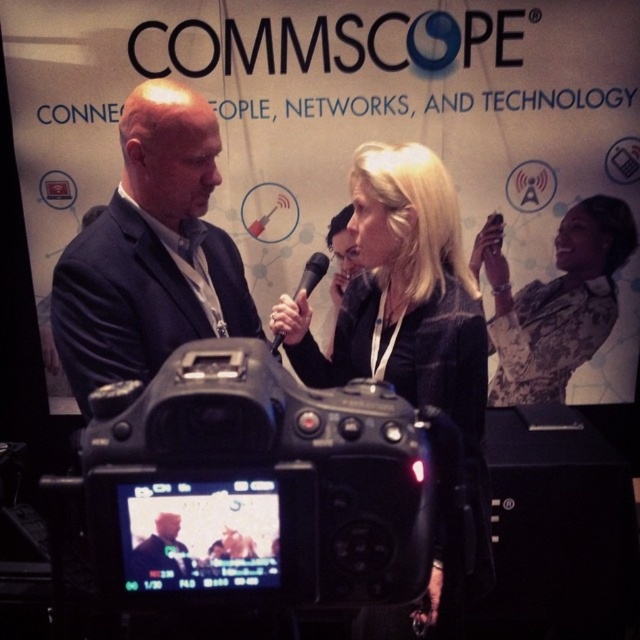
Between dark blue suit at center and black matte microphone at center, which one has less height?

black matte microphone at center

Who is taller, dark blue suit at center or black matte microphone at center?

dark blue suit at center

Does point (200, 148) come in front of point (314, 272)?

Yes, it is.

Locate an element on the screen. dark blue suit at center is located at coordinates (150, 252).

Is the position of dark blue suit at center more distant than that of matte black suit at center?

Yes, dark blue suit at center is behind matte black suit at center.

Who is lower down, dark blue suit at center or matte black suit at center?

matte black suit at center is below.

Between point (76, 326) and point (147, 561), which one is positioned in front?

Point (147, 561)

I want to click on dark blue suit at center, so click(x=150, y=252).

Between matte black suit at center and black matte microphone at center, which one has less height?

Standing shorter between the two is matte black suit at center.

Can you confirm if matte black suit at center is positioned to the left of black matte microphone at center?

Indeed, matte black suit at center is positioned on the left side of black matte microphone at center.

Is point (179, 573) positioned in front of point (294, 296)?

Yes.

Where is `matte black suit at center`? matte black suit at center is located at coordinates [x=161, y=550].